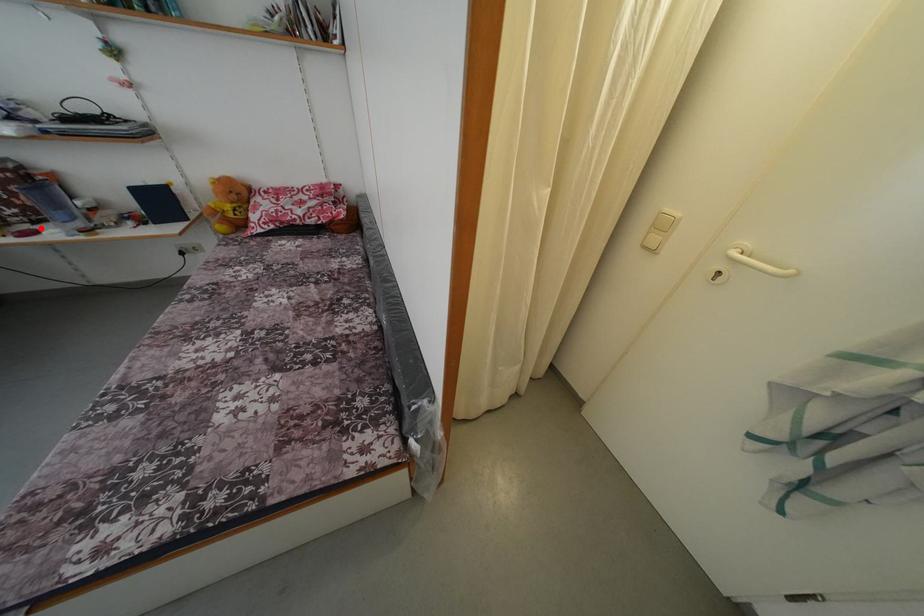
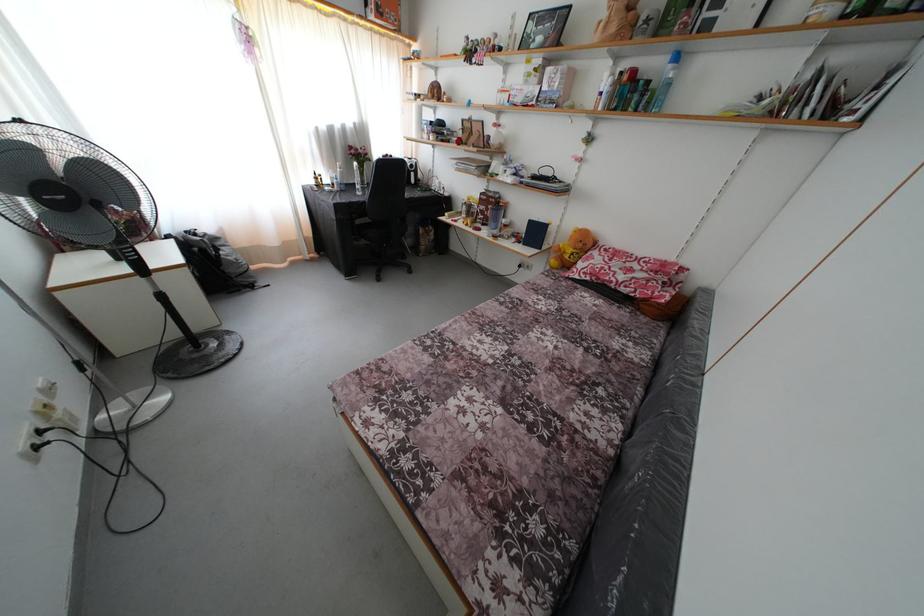
In the second image, find the point that corresponds to the highlighted location in the first image.

(488, 230)